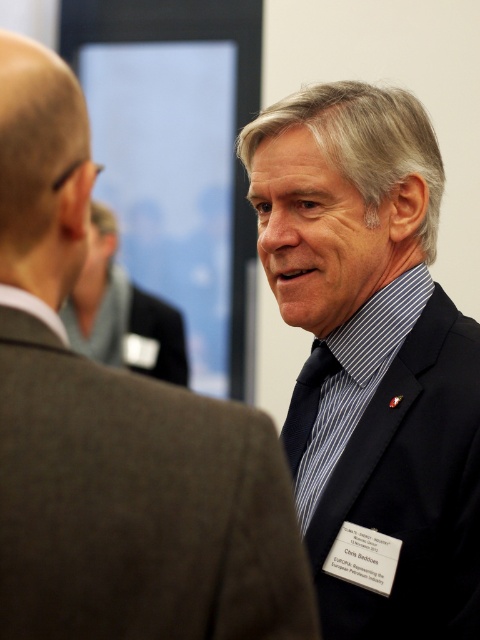
Between matte black suit at center and dark blue silk tie at center, which one is positioned lower?

dark blue silk tie at center

Is matte black suit at center to the left of dark blue silk tie at center from the viewer's perspective?

Yes, matte black suit at center is to the left of dark blue silk tie at center.

Which is behind, point (94, 348) or point (312, 412)?

The point (94, 348) is behind.

Image resolution: width=480 pixels, height=640 pixels. Find the location of `matte black suit at center`. matte black suit at center is located at coordinates (121, 312).

Between matte black suit at right and matte black suit at center, which one is positioned lower?

matte black suit at right

Identify the location of matte black suit at right. Image resolution: width=480 pixels, height=640 pixels. (137, 504).

Between point (153, 380) and point (136, 301), which one is positioned behind?

The point (136, 301) is more distant.

You are a GUI agent. You are given a task and a screenshot of the screen. Output one action in this format:
    pyautogui.click(x=<x>, y=<y>)
    Task: Click on the matte black suit at right
    The height and width of the screenshot is (640, 480).
    Given the screenshot: What is the action you would take?
    pyautogui.click(x=137, y=504)

Between blue striped shirt at center and matte black suit at center, which one appears on the right side from the viewer's perspective?

Positioned to the right is blue striped shirt at center.

Between point (393, 157) and point (109, 216), which one is positioned in front?

Positioned in front is point (393, 157).

At what (x,y) coordinates should I click in order to perform the action: click on blue striped shirt at center. Please return your answer as a coordinate pair (x, y). This screenshot has width=480, height=640. Looking at the image, I should click on (373, 349).

The width and height of the screenshot is (480, 640). I want to click on blue striped shirt at center, so click(x=373, y=349).